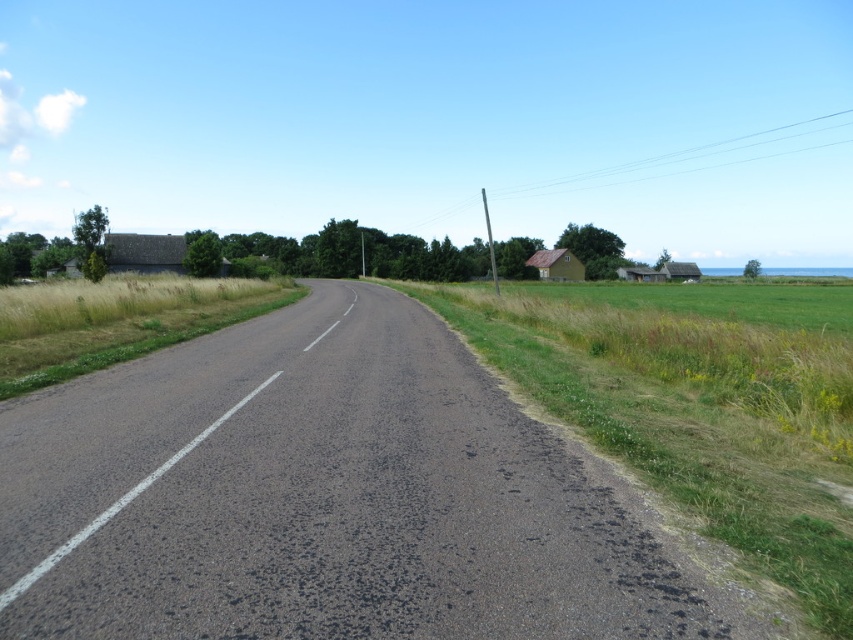
Is point (567, 371) more distant than point (45, 376)?

That is True.

Is green grass at center smaller than green grass at left?

Indeed, green grass at center has a smaller size compared to green grass at left.

Locate an element on the screen. This screenshot has width=853, height=640. green grass at center is located at coordinates (683, 445).